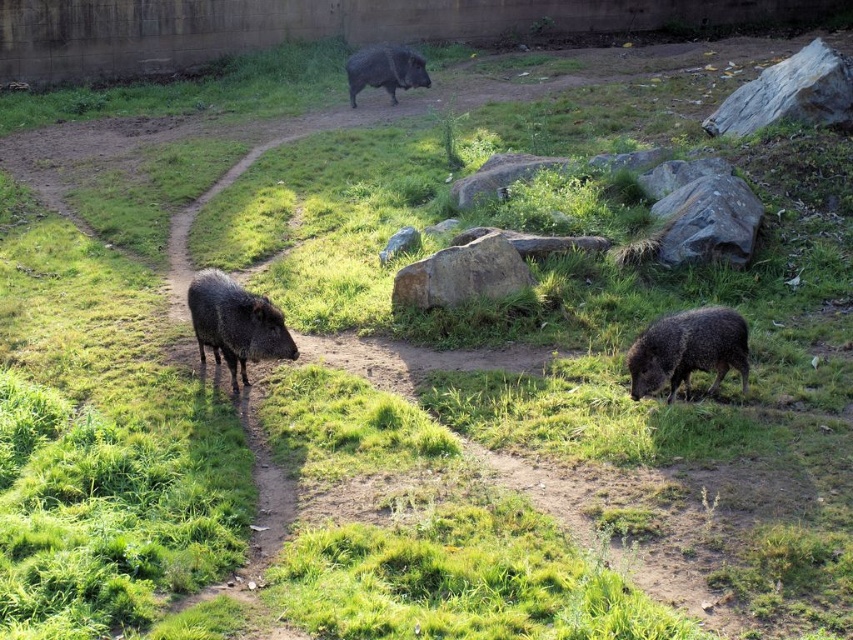
Does dark gray spiny at center have a smaller size compared to dark gray textured pig at upper center?

Yes, dark gray spiny at center is smaller than dark gray textured pig at upper center.

Is point (199, 344) farther from camera compared to point (412, 58)?

No, it is in front of (412, 58).

Is point (238, 323) farther from camera compared to point (387, 48)?

No, it is not.

Identify the location of dark gray spiny at center. (235, 323).

Between dark gray spiny at lower right and dark gray spiny at center, which one appears on the left side from the viewer's perspective?

dark gray spiny at center is more to the left.

Between dark gray spiny at lower right and dark gray spiny at center, which one is positioned lower?

dark gray spiny at lower right is below.

Which is in front, point (643, 362) or point (216, 323)?

Positioned in front is point (643, 362).

Where is `dark gray spiny at lower right`? The width and height of the screenshot is (853, 640). dark gray spiny at lower right is located at coordinates (688, 349).

Can you confirm if dark gray spiny at lower right is shorter than dark gray textured pig at upper center?

Correct, dark gray spiny at lower right is not as tall as dark gray textured pig at upper center.

Does point (643, 337) come farther from viewer compared to point (422, 58)?

No, it is in front of (422, 58).

Find the location of `dark gray spiny at lower right`. dark gray spiny at lower right is located at coordinates (688, 349).